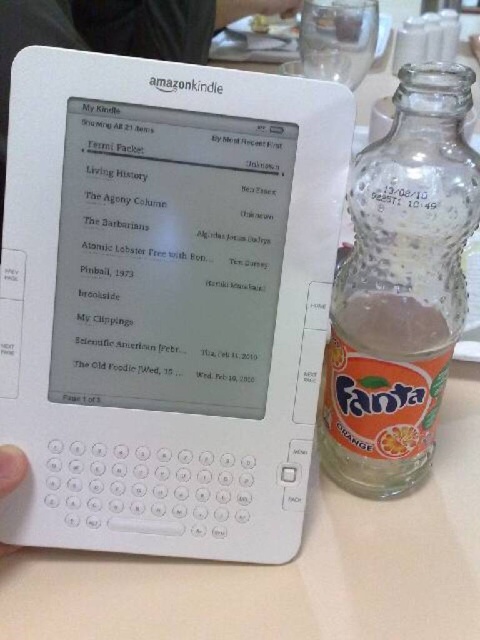
Based on the photo, between orange carbonated drink at right and matte plastic fork at upper center, which one appears on the right side from the viewer's perspective?

orange carbonated drink at right is more to the right.

Can you confirm if orange carbonated drink at right is positioned below matte plastic fork at upper center?

Yes, orange carbonated drink at right is below matte plastic fork at upper center.

Which is behind, point (392, 340) or point (240, 0)?

Positioned behind is point (240, 0).

At what (x,y) coordinates should I click in order to perform the action: click on orange carbonated drink at right. Please return your answer as a coordinate pair (x, y). The width and height of the screenshot is (480, 640). Looking at the image, I should click on (382, 392).

Is white matte amazon kindle at center wider than skinny white hand at lower left?

Correct, the width of white matte amazon kindle at center exceeds that of skinny white hand at lower left.

Who is more distant from viewer, (52,330) or (6,474)?

Positioned behind is point (52,330).

Identify the location of white matte amazon kindle at center. The height and width of the screenshot is (640, 480). (166, 301).

Between orange carbonated drink at right and skinny white hand at lower left, which one has more height?

Standing taller between the two is orange carbonated drink at right.

This screenshot has width=480, height=640. What are the coordinates of `orange carbonated drink at right` in the screenshot? It's located at (382, 392).

What do you see at coordinates (382, 392) in the screenshot? I see `orange carbonated drink at right` at bounding box center [382, 392].

Identify the location of orange carbonated drink at right. (382, 392).